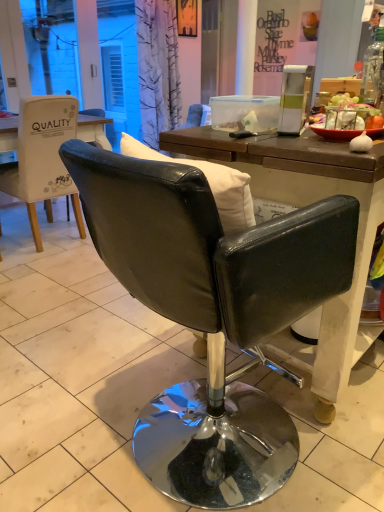
Question: Based on their positions, is matte black sign at upper center located to the left or right of transparent glass bottle at upper right?

Choices:
 (A) right
 (B) left

Answer: (A)

Question: Does point (264, 61) appear closer or farther from the camera than point (377, 90)?

Choices:
 (A) farther
 (B) closer

Answer: (A)

Question: Which object is positioned farthest from the transparent glass bottle at upper right?

Choices:
 (A) matte black sign at upper center
 (B) black leather chair at center, which is the 1th chair from front to back
 (C) white leather chair at left, acting as the first chair starting from the back

Answer: (A)

Question: Estimate the real-world distances between objects in this image. Which object is closer to the black leather chair at center, which is the second chair in back-to-front order?

Choices:
 (A) transparent glass bottle at upper right
 (B) matte black sign at upper center
 (C) white leather chair at left, which is the 2th chair from right to left

Answer: (A)